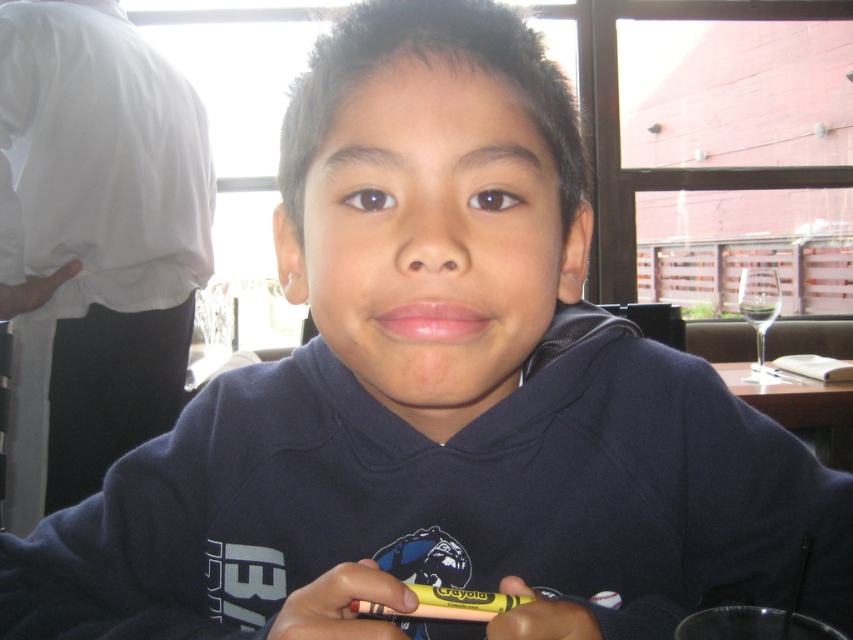
Question: Which of the following is the farthest from the observer?

Choices:
 (A) yellow plastic crayon at lower center
 (B) wooden table at center
 (C) yellow matte crayon at center

Answer: (B)

Question: Does wooden table at center have a larger size compared to yellow plastic crayon at lower center?

Choices:
 (A) no
 (B) yes

Answer: (B)

Question: Estimate the real-world distances between objects in this image. Which object is farther from the yellow matte crayon at center?

Choices:
 (A) yellow plastic crayon at lower center
 (B) wooden table at center

Answer: (B)

Question: Can you confirm if yellow matte crayon at center is positioned to the left of wooden table at center?

Choices:
 (A) no
 (B) yes

Answer: (B)

Question: From the image, what is the correct spatial relationship of wooden table at center in relation to yellow plastic crayon at lower center?

Choices:
 (A) below
 (B) above

Answer: (A)

Question: Which point is closer to the camera?

Choices:
 (A) yellow matte crayon at center
 (B) yellow plastic crayon at lower center

Answer: (A)